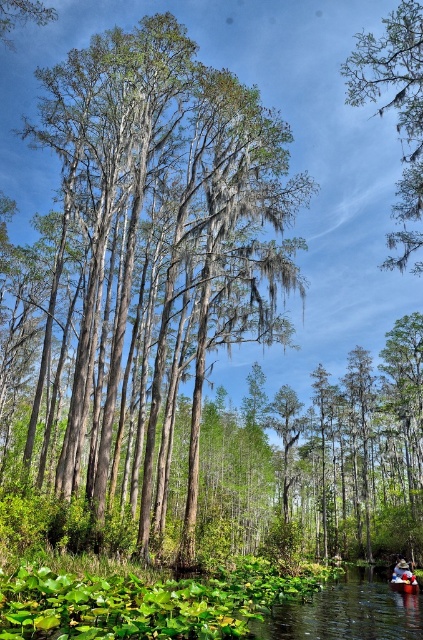
You are a bird flying over the swampy area. You see the green mossy branch at upper right. Where exactly is it located in the image?

The green mossy branch at upper right is located at point (395, 109) in the image.

You are a bird flying over the swampy area. You see the green mossy branch at upper right and the green leafy river at lower center. Which object is positioned higher in the scene?

The green mossy branch at upper right is positioned higher in the scene than the green leafy river at lower center.